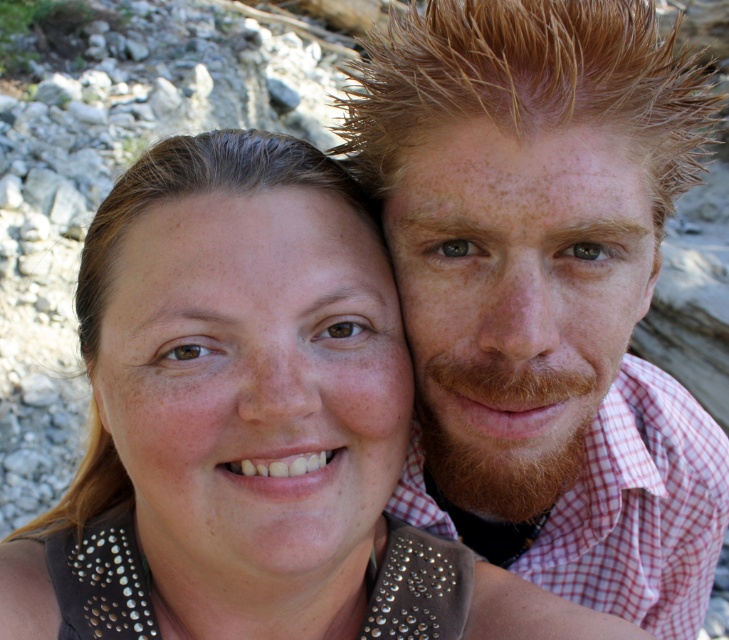
Question: Which object appears farthest from the camera in this image?

Choices:
 (A) red checkered shirt at right
 (B) brown studded leather jacket at center
 (C) reddish-brown hair at upper right

Answer: (A)

Question: Among these objects, which one is nearest to the camera?

Choices:
 (A) brown studded leather jacket at center
 (B) reddish-brown hair at upper right

Answer: (A)

Question: Does brown studded leather jacket at center have a larger size compared to red checkered shirt at right?

Choices:
 (A) no
 (B) yes

Answer: (B)

Question: Among these objects, which one is nearest to the camera?

Choices:
 (A) red checkered shirt at right
 (B) brown studded leather jacket at center
 (C) reddish-brown hair at upper right

Answer: (B)

Question: Can you confirm if reddish-brown hair at upper right is smaller than brown studded leather jacket at center?

Choices:
 (A) no
 (B) yes

Answer: (A)

Question: Does reddish-brown hair at upper right come in front of red checkered shirt at right?

Choices:
 (A) yes
 (B) no

Answer: (A)